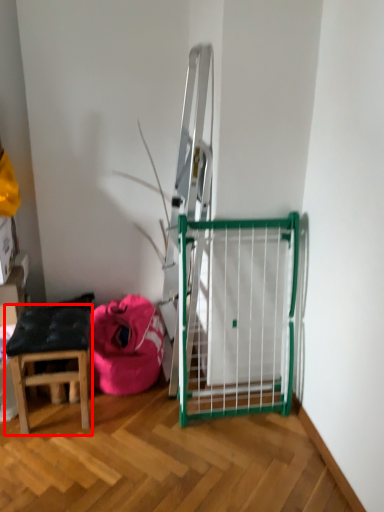
Question: In this image, where is stool (annotated by the red box) located relative to bean bag chair?

Choices:
 (A) left
 (B) right

Answer: (A)